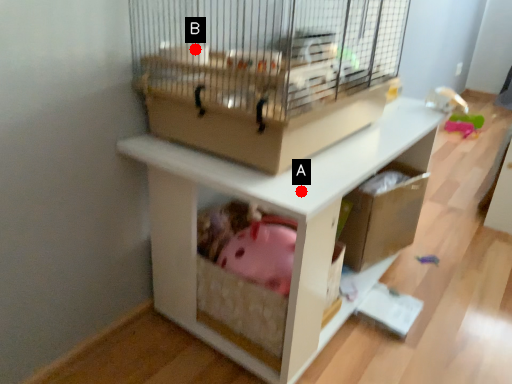
Question: Two points are circled on the image, labeled by A and B beside each circle. Which point is further to the camera?

Choices:
 (A) A is further
 (B) B is further

Answer: (B)